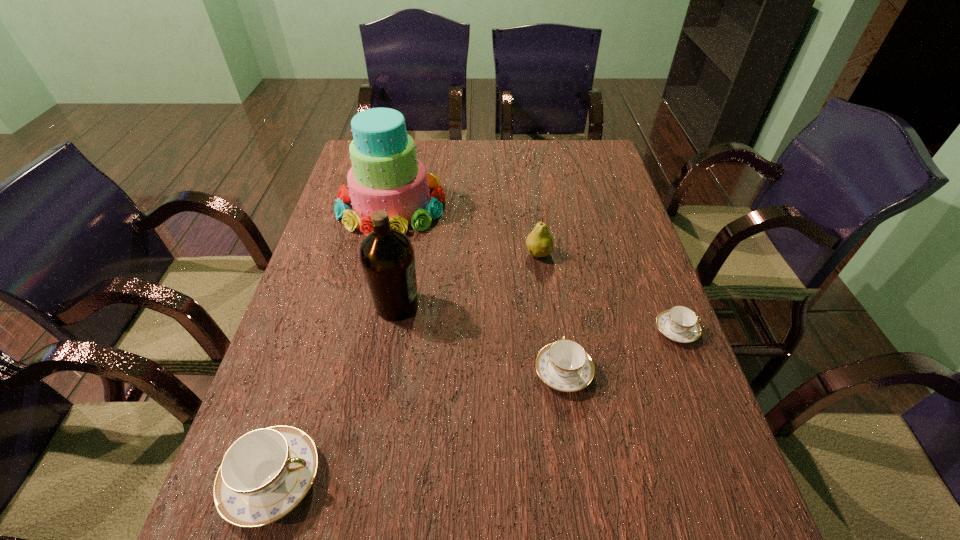
Where is `vacant position for inserting another teacup evenly`? vacant position for inserting another teacup evenly is located at coordinates (431, 421).